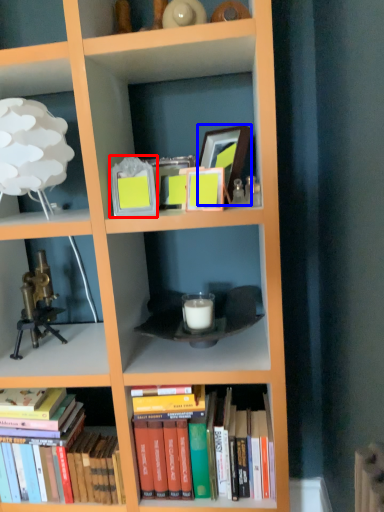
Question: Which point is further to the camera, picture frame (highlighted by a red box) or picture frame (highlighted by a blue box)?

Choices:
 (A) picture frame
 (B) picture frame

Answer: (B)